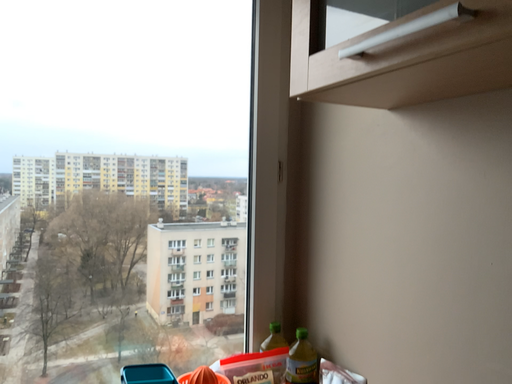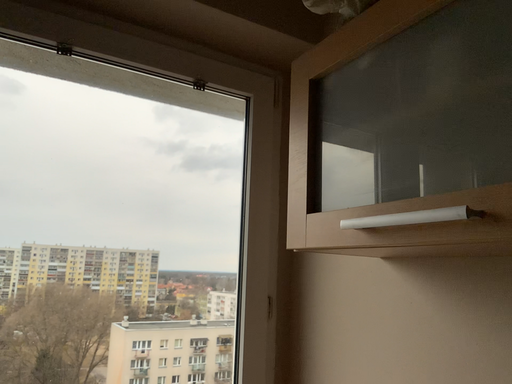
Question: Which way did the camera rotate in the video?

Choices:
 (A) rotated upward
 (B) rotated downward

Answer: (A)